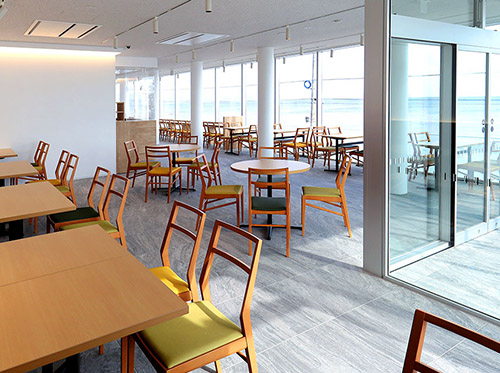
Locate an element on the screen. tables is located at coordinates (94, 302), (69, 246), (16, 168), (4, 149), (270, 164), (182, 148), (459, 141), (347, 135), (285, 132), (239, 127).